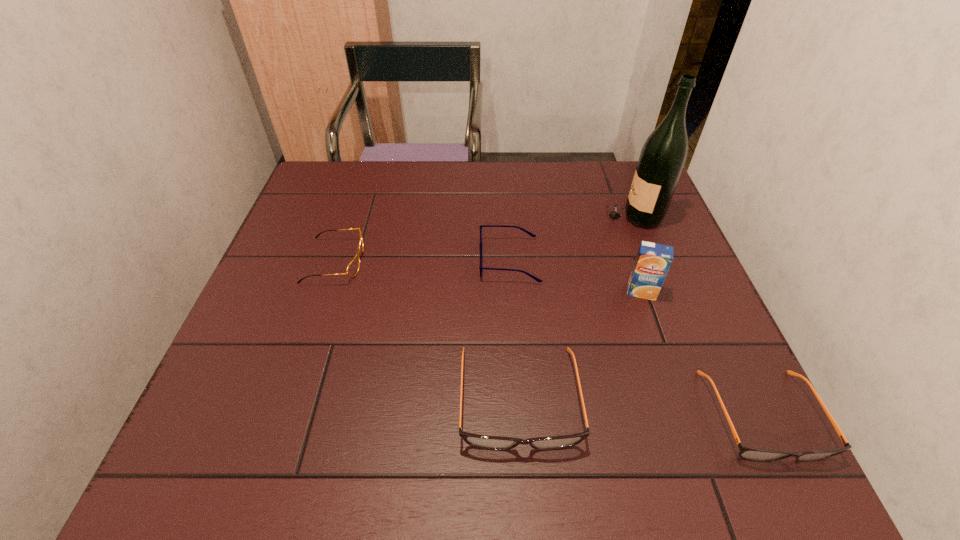
This screenshot has height=540, width=960. What are the coordinates of `the tallest spectacles` in the screenshot? It's located at (480, 441).

Locate an element on the screen. This screenshot has height=540, width=960. the rightmost spectacles is located at coordinates (750, 453).

This screenshot has height=540, width=960. What are the coordinates of `the second tallest object` in the screenshot? It's located at (653, 260).

Locate an element on the screen. wine bottle is located at coordinates (662, 158).

I want to click on the tallest object, so click(x=662, y=158).

The height and width of the screenshot is (540, 960). Identify the location of the leftmost spectacles. (352, 269).

You are a GUI agent. You are given a task and a screenshot of the screen. Output one action in this format:
    pyautogui.click(x=<x>, y=<y>)
    Task: Click on the vacant space located on the back of the orange_juice
    This screenshot has height=540, width=960.
    Given the screenshot: What is the action you would take?
    pyautogui.click(x=622, y=237)

Identify the location of free point located on the front of the farthest object. (653, 267).

Image resolution: width=960 pixels, height=540 pixels. I want to click on vacant space located 0.080m on the front-facing side of the leftmost spectacles, so click(x=395, y=261).

Find the location of a particular element. The height and width of the screenshot is (540, 960). object situated at the far edge is located at coordinates (662, 158).